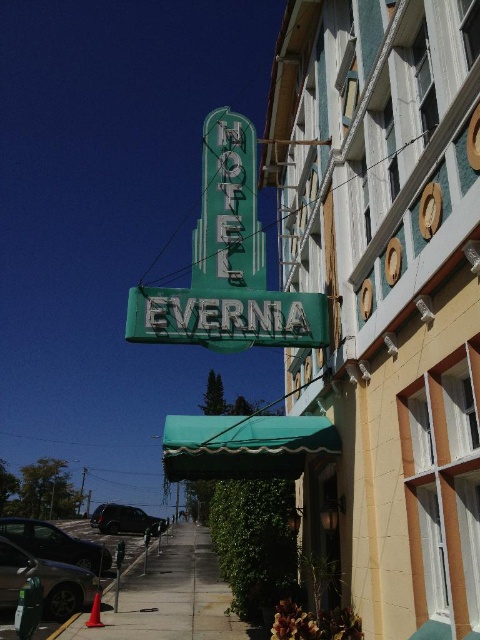
You are a photographer standing in front of the HOTEL EVERNIA building. You want to take a photo of the green neon sign at center and the shiny silver sedan at lower left. Can you capture both objects in the same frame without any obstruction?

Yes, the green neon sign at center is in front of the shiny silver sedan at lower left, so both can be captured in the same frame without obstruction.

You are standing in front of the Hotel Evernia and want to take a photo of the yellow brick building at center and the metallic silver car at lower left. Which object should you focus on first to ensure both are in the frame?

You should focus on the yellow brick building at center first because it is closer to the viewer than the metallic silver car at lower left, so adjusting the camera to capture it ensures the car will also be in the frame.

You are standing in front of the HOTEL EVERNIA building and need to locate the green neon sign at center. According to the coordinates provided, where exactly is the green neon sign positioned relative to the building?

The green neon sign at center is located at point coordinates 0.414 on the x axis and 0.475 on the y axis.